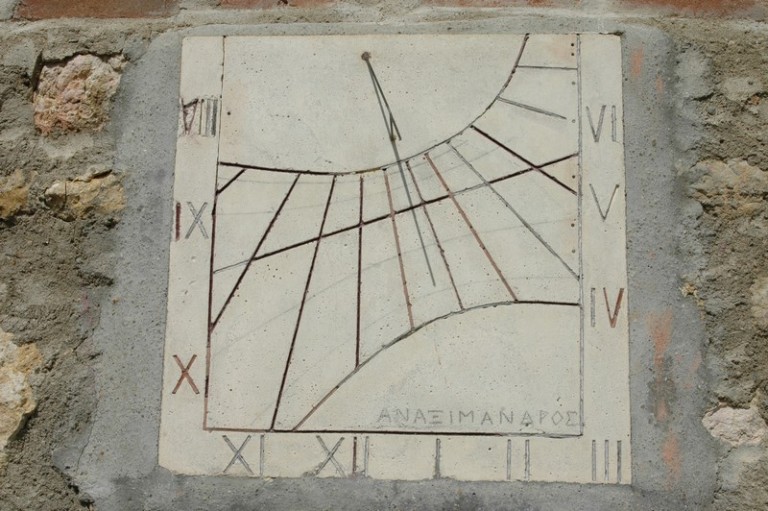
Find the location of a particular element. floor on the right side is located at coordinates (760, 278).